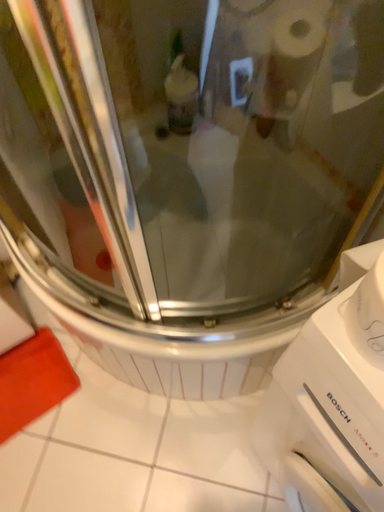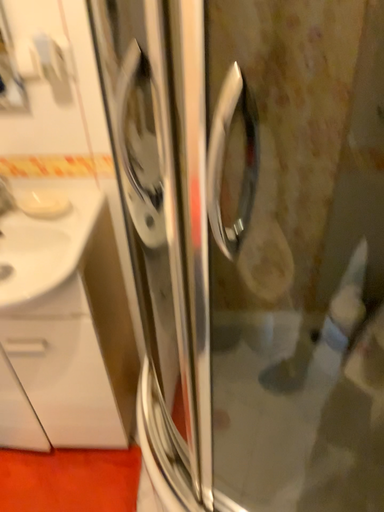
Question: Which way did the camera rotate in the video?

Choices:
 (A) rotated upward
 (B) rotated downward

Answer: (A)